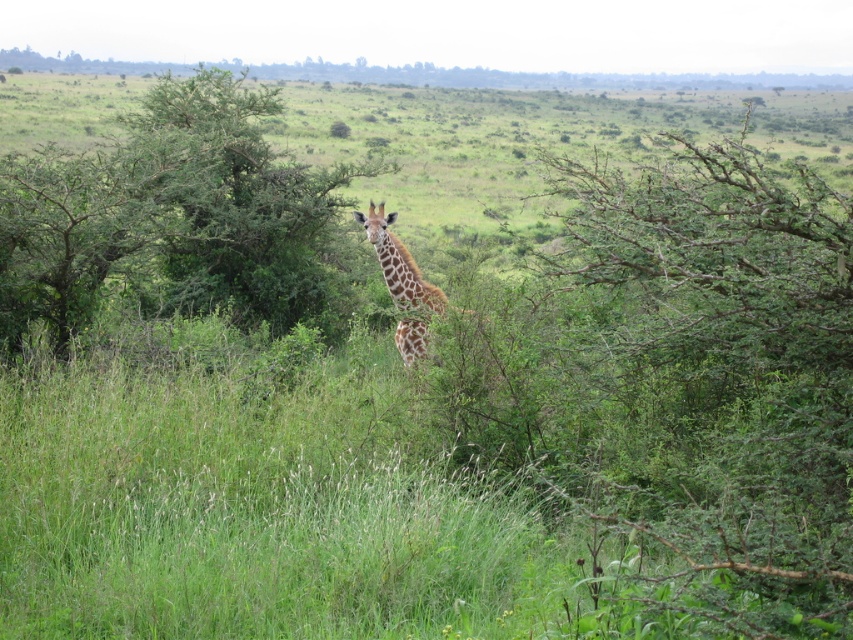
Is green leafy bush at center thinner than green leafy tree at center?

Yes.

Does green leafy bush at center appear on the left side of green leafy tree at center?

No, green leafy bush at center is not to the left of green leafy tree at center.

Is point (708, 307) closer to viewer compared to point (235, 189)?

Yes, point (708, 307) is closer to viewer.

Locate an element on the screen. The image size is (853, 640). green leafy bush at center is located at coordinates (723, 381).

Does green leafy tree at center appear under spotted fur giraffe at center?

Incorrect, green leafy tree at center is not positioned below spotted fur giraffe at center.

Is point (91, 179) positioned before point (378, 259)?

Yes, point (91, 179) is in front of point (378, 259).

The height and width of the screenshot is (640, 853). In order to click on green leafy tree at center in this screenshot , I will do `click(171, 218)`.

Is green leafy bush at center below spotted fur giraffe at center?

Incorrect, green leafy bush at center is not positioned below spotted fur giraffe at center.

Who is more forward, (761, 486) or (367, 237)?

Positioned in front is point (761, 486).

Identify the location of green leafy bush at center. The height and width of the screenshot is (640, 853). (723, 381).

Where is `green leafy bush at center`? This screenshot has height=640, width=853. green leafy bush at center is located at coordinates (723, 381).